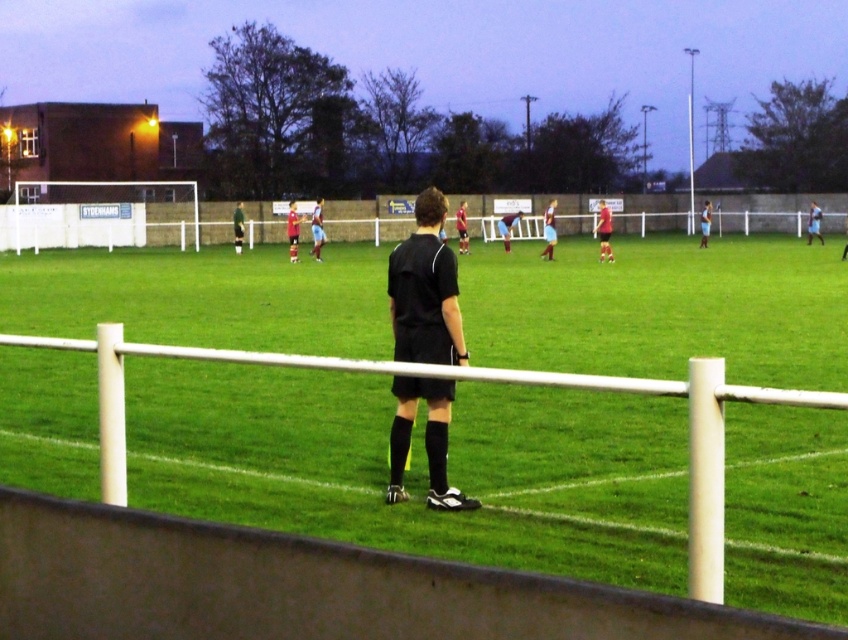
Question: Which object is farther from the camera taking this photo?

Choices:
 (A) green grass football field at center
 (B) matte black shorts at center

Answer: (B)

Question: Is matte black shorts at center closer to the viewer compared to black jersey at center?

Choices:
 (A) no
 (B) yes

Answer: (B)

Question: Is green grass football field at center to the left of black matte referee at center from the viewer's perspective?

Choices:
 (A) yes
 (B) no

Answer: (B)

Question: Among these points, which one is farthest from the camera?

Choices:
 (A) (600, 256)
 (B) (393, 458)

Answer: (A)

Question: Is green grass football field at center in front of black jersey at center?

Choices:
 (A) yes
 (B) no

Answer: (A)

Question: Which point is farther to the camera?

Choices:
 (A) (416, 205)
 (B) (620, 449)
 (C) (606, 225)
 (D) (294, 240)

Answer: (D)